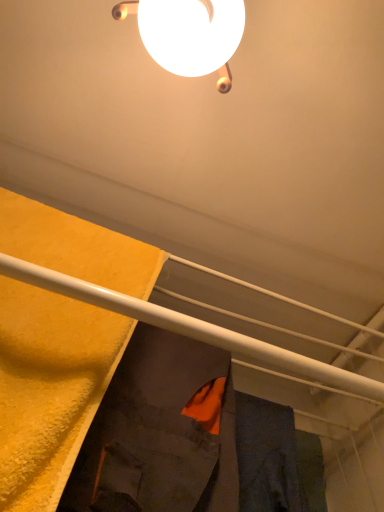
Question: Which direction should I rotate to look at orange fabric at center, marked as the first robe in a right-to-left arrangement, — up or down?

Choices:
 (A) up
 (B) down

Answer: (B)

Question: From the image's perspective, is dark gray fabric robe at center, the 2th robe from the right, on orange fabric at center, marked as the first robe in a right-to-left arrangement?

Choices:
 (A) no
 (B) yes

Answer: (B)

Question: Does dark gray fabric robe at center, the 2th robe from the right, have a larger size compared to orange fabric at center, the second robe positioned from the left?

Choices:
 (A) yes
 (B) no

Answer: (A)

Question: Is dark gray fabric robe at center, the 2th robe from the right, far from orange fabric at center, marked as the first robe in a right-to-left arrangement?

Choices:
 (A) no
 (B) yes

Answer: (A)

Question: Can you confirm if dark gray fabric robe at center, the 2th robe from the right, is taller than orange fabric at center, the second robe positioned from the left?

Choices:
 (A) yes
 (B) no

Answer: (A)

Question: Is dark gray fabric robe at center, which is counted as the 1th robe, starting from the left, smaller than orange fabric at center, the second robe positioned from the left?

Choices:
 (A) yes
 (B) no

Answer: (B)

Question: Is dark gray fabric robe at center, the 2th robe from the right, turned away from orange fabric at center, marked as the first robe in a right-to-left arrangement?

Choices:
 (A) no
 (B) yes

Answer: (A)

Question: Can you see orange fabric at center, marked as the first robe in a right-to-left arrangement, touching dark gray fabric robe at center, which is counted as the 1th robe, starting from the left?

Choices:
 (A) no
 (B) yes

Answer: (A)

Question: Does orange fabric at center, marked as the first robe in a right-to-left arrangement, have a smaller size compared to dark gray fabric robe at center, which is counted as the 1th robe, starting from the left?

Choices:
 (A) no
 (B) yes

Answer: (B)

Question: Is orange fabric at center, marked as the first robe in a right-to-left arrangement, not inside dark gray fabric robe at center, which is counted as the 1th robe, starting from the left?

Choices:
 (A) no
 (B) yes

Answer: (B)

Question: Does orange fabric at center, the second robe positioned from the left, have a greater height compared to dark gray fabric robe at center, which is counted as the 1th robe, starting from the left?

Choices:
 (A) yes
 (B) no

Answer: (B)

Question: Is orange fabric at center, marked as the first robe in a right-to-left arrangement, at the right side of dark gray fabric robe at center, the 2th robe from the right?

Choices:
 (A) no
 (B) yes

Answer: (B)

Question: Is orange fabric at center, the second robe positioned from the left, at the left side of dark gray fabric robe at center, the 2th robe from the right?

Choices:
 (A) yes
 (B) no

Answer: (B)

Question: Does orange fabric at center, the second robe positioned from the left, appear on the left side of white glossy lamp at upper center?

Choices:
 (A) no
 (B) yes

Answer: (A)